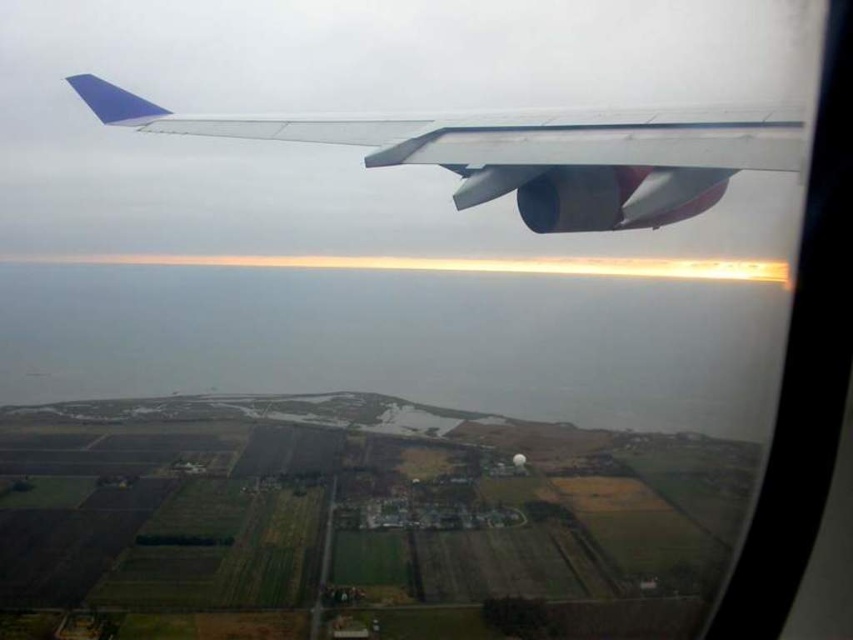
Question: Among these points, which one is nearest to the camera?

Choices:
 (A) (468, 476)
 (B) (212, 129)

Answer: (B)

Question: Which point is farther from the camera taking this photo?

Choices:
 (A) (662, 148)
 (B) (373, 593)

Answer: (B)

Question: Is green grassy fields at lower center positioned at the back of metallic silver wing at upper center?

Choices:
 (A) yes
 (B) no

Answer: (A)

Question: Is green grassy fields at lower center bigger than metallic silver wing at upper center?

Choices:
 (A) no
 (B) yes

Answer: (B)

Question: Is green grassy fields at lower center wider than metallic silver wing at upper center?

Choices:
 (A) yes
 (B) no

Answer: (A)

Question: Which point is closer to the camera?

Choices:
 (A) (601, 573)
 (B) (657, 129)

Answer: (B)